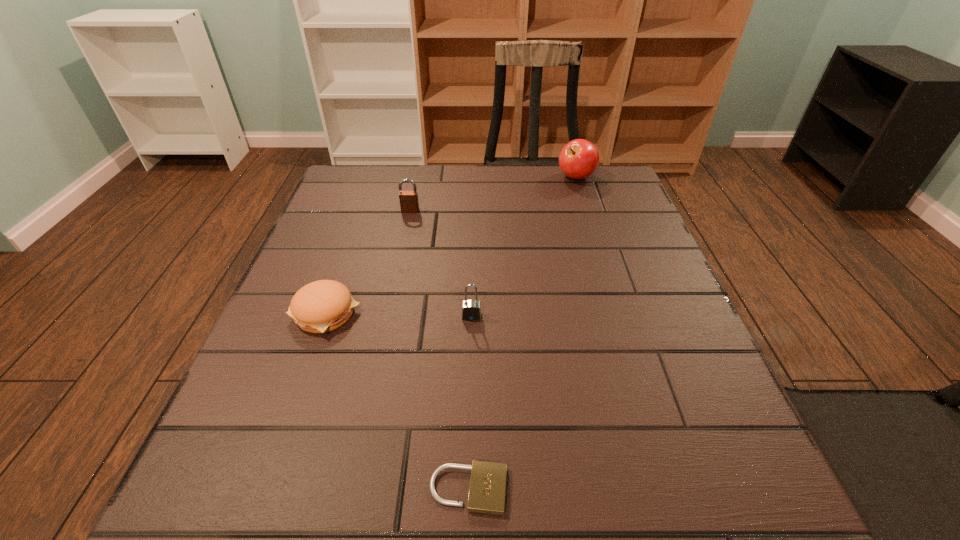
At what (x,y) coordinates should I click in order to perform the action: click on the farthest object. Please return your answer as a coordinate pair (x, y). The width and height of the screenshot is (960, 540). Looking at the image, I should click on (579, 159).

At what (x,y) coordinates should I click in order to perform the action: click on the tallest object. Please return your answer as a coordinate pair (x, y). Looking at the image, I should click on (579, 159).

Where is `the fourth nearest object`? The width and height of the screenshot is (960, 540). the fourth nearest object is located at coordinates (409, 203).

Locate an element on the screen. The height and width of the screenshot is (540, 960). the leftmost padlock is located at coordinates (409, 203).

I want to click on the second nearest padlock, so click(471, 310).

Image resolution: width=960 pixels, height=540 pixels. In order to click on the fourth tallest object in this screenshot , I will do click(322, 306).

At what (x,y) coordinates should I click in order to perform the action: click on the leftmost object. Please return your answer as a coordinate pair (x, y). The height and width of the screenshot is (540, 960). Looking at the image, I should click on (322, 306).

Locate an element on the screen. the nearest padlock is located at coordinates (487, 488).

This screenshot has height=540, width=960. I want to click on the shortest padlock, so click(x=487, y=488).

What are the coordinates of `vacant space located on the left of the rightmost object` in the screenshot? It's located at (528, 178).